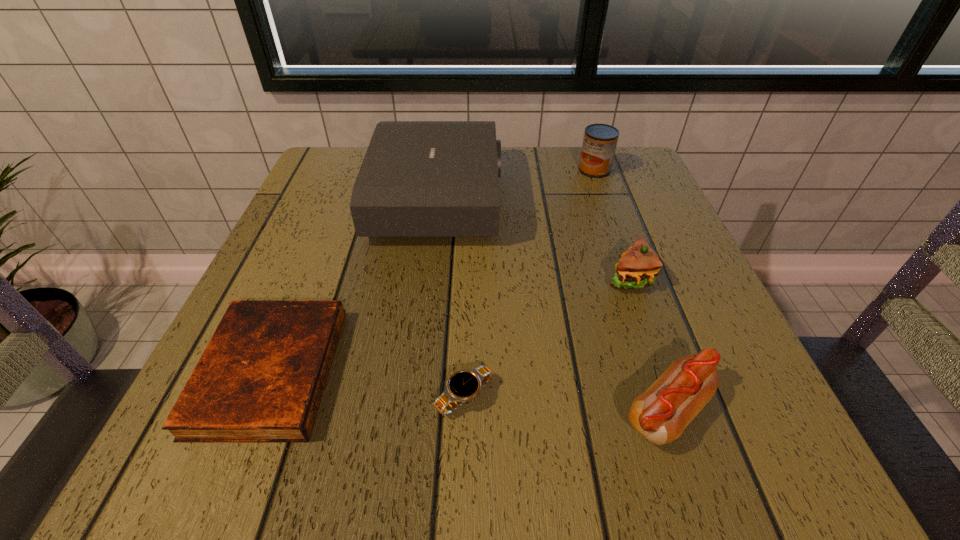
Where is `free space located on the spine side of the Bible`? free space located on the spine side of the Bible is located at coordinates (446, 372).

You are a GUI agent. You are given a task and a screenshot of the screen. Output one action in this format:
    pyautogui.click(x=<x>, y=<y>)
    Task: Click on the blank area located 0.290m on the left of the watch
    The height and width of the screenshot is (540, 960).
    Given the screenshot: What is the action you would take?
    pyautogui.click(x=228, y=397)

This screenshot has height=540, width=960. I want to click on projector that is positioned at the far edge, so point(418,178).

Where is `can at the far edge`? This screenshot has height=540, width=960. can at the far edge is located at coordinates tap(600, 140).

Find the location of a particular element. sausage that is at the near edge is located at coordinates (660, 414).

Where is `Bible at the near edge`? This screenshot has height=540, width=960. Bible at the near edge is located at coordinates (261, 378).

The width and height of the screenshot is (960, 540). I want to click on watch that is at the near edge, so (x=463, y=385).

Identify the location of object located at the left edge. The image size is (960, 540). (261, 378).

The image size is (960, 540). What are the coordinates of `can at the right edge` in the screenshot? It's located at (600, 140).

The height and width of the screenshot is (540, 960). I want to click on sandwich present at the right edge, so click(638, 266).